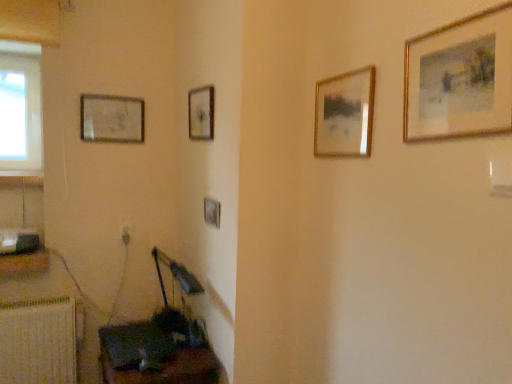
Question: Is wooden radiator at lower left wider or thinner than wooden frame painting at center, arranged as the 2th picture frame when viewed from the front?

Choices:
 (A) wide
 (B) thin

Answer: (A)

Question: Considering the positions of wooden radiator at lower left and wooden frame painting at center, which is counted as the 4th picture frame, starting from the back, in the image, is wooden radiator at lower left bigger or smaller than wooden frame painting at center, which is counted as the 4th picture frame, starting from the back,?

Choices:
 (A) big
 (B) small

Answer: (A)

Question: Based on their relative distances, which object is nearer to the gold-framed painting at upper right, the first picture frame in the right-to-left sequence?

Choices:
 (A) wooden radiator at lower left
 (B) wooden frame painting at center, the 2th picture frame in the right-to-left sequence
 (C) wooden frame at center, marked as the 4th picture frame in a right-to-left arrangement
 (D) wooden picture frame at upper left, the fifth picture frame in the front-to-back sequence
 (E) wooden picture frame at lower left, acting as the third picture frame starting from the front

Answer: (B)

Question: Which object is positioned closest to the wooden frame at center, which is the second picture frame from left to right?

Choices:
 (A) wooden picture frame at upper left, which is the 5th picture frame from right to left
 (B) wooden dark brown table at lower left
 (C) wooden picture frame at lower left, acting as the third picture frame starting from the front
 (D) gold-framed painting at upper right, marked as the fifth picture frame in a left-to-right arrangement
 (E) white plastic electric outlet at lower left

Answer: (C)